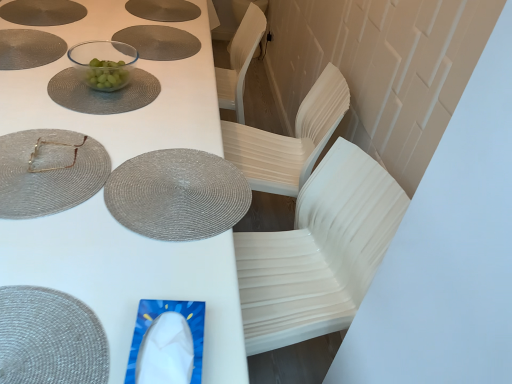
The height and width of the screenshot is (384, 512). I want to click on vacant area that is in front of matte silver placemat at upper left, the 2th platter viewed from the right, so click(34, 35).